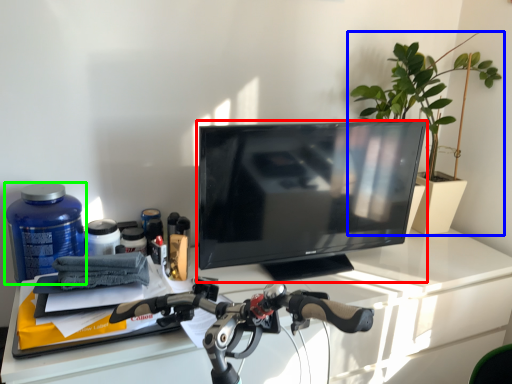
Question: Based on their relative distances, which object is farther from television (highlighted by a red box)? Choose from houseplant (highlighted by a blue box) and bottle (highlighted by a green box).

Choices:
 (A) houseplant
 (B) bottle

Answer: (B)